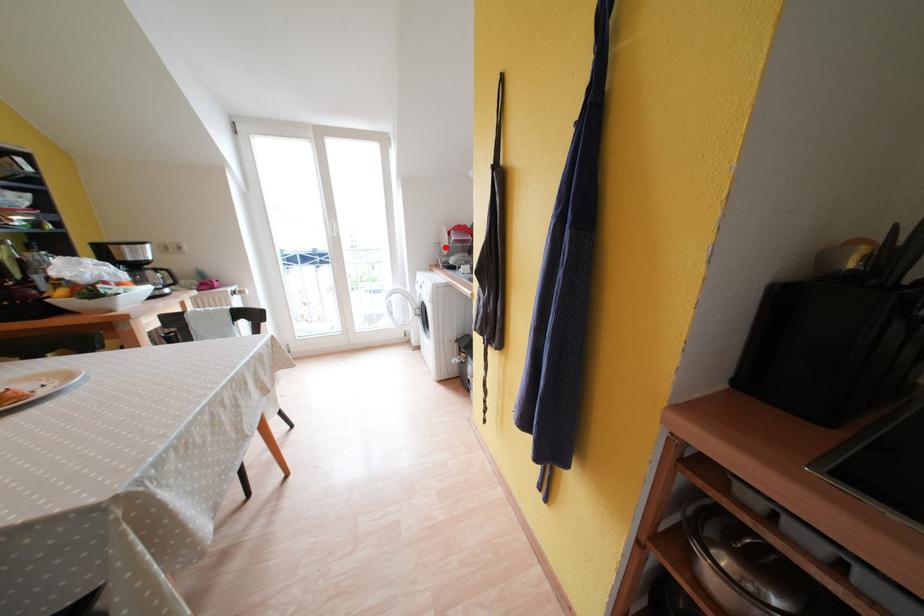
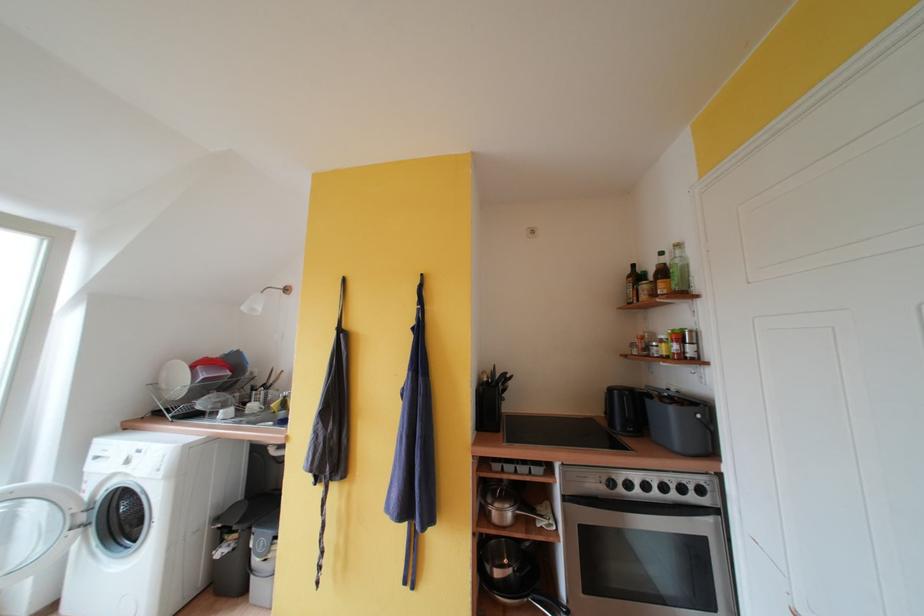
Question: I am providing you with two images of the same scene from different viewpoints. Image1 has a red point marked. In image2, the corresponding 3D location appears at what relative position? Reply with the corresponding letter.

Choices:
 (A) Closer
 (B) Farther

Answer: (B)